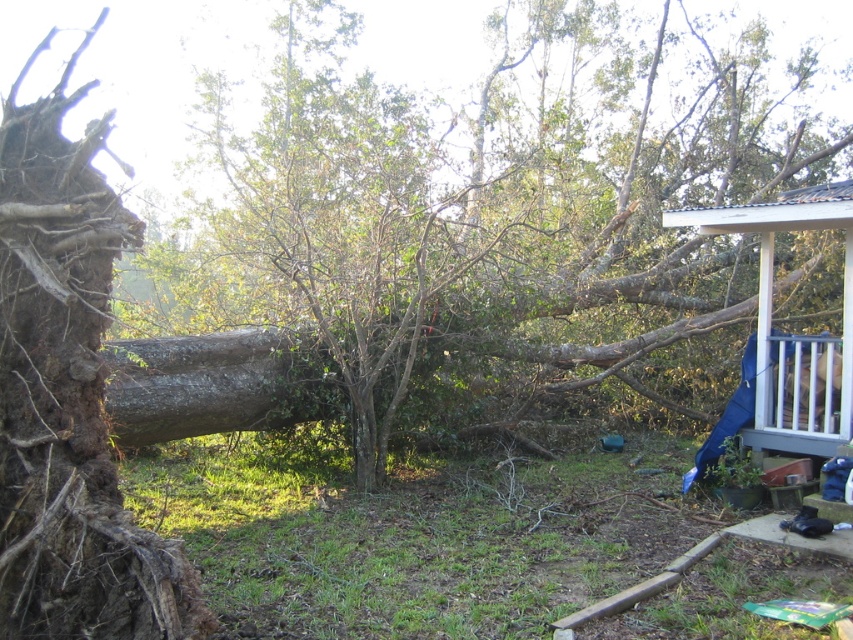
Can you confirm if brown rough bark at left is wider than white wooden porch at upper right?

No.

Is point (36, 172) behind point (793, 340)?

No, it is not.

I want to click on brown rough bark at left, so 68,396.

The height and width of the screenshot is (640, 853). Identify the location of brown rough bark at left. point(68,396).

Consider the image. Does green rough bark tree at center have a smaller size compared to brown rough bark at left?

No.

The width and height of the screenshot is (853, 640). Identify the location of green rough bark tree at center. (488, 211).

Who is higher up, green rough bark tree at center or white wooden porch at upper right?

green rough bark tree at center is above.

Is green rough bark tree at center below white wooden porch at upper right?

No.

Locate an element on the screen. green rough bark tree at center is located at coordinates (488, 211).

I want to click on green rough bark tree at center, so [x=488, y=211].